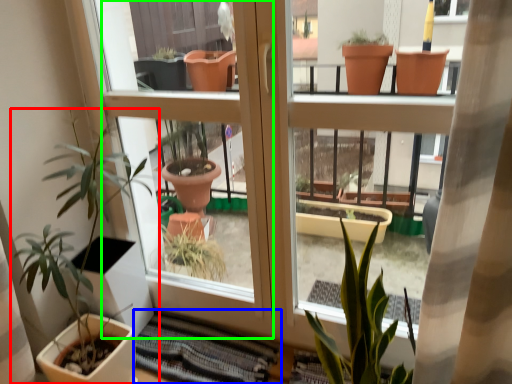
Question: Estimate the real-world distances between objects in this image. Which object is closer to houseplant (highlighted by a red box), atrium (highlighted by a blue box) or screen door (highlighted by a green box)?

Choices:
 (A) atrium
 (B) screen door

Answer: (B)